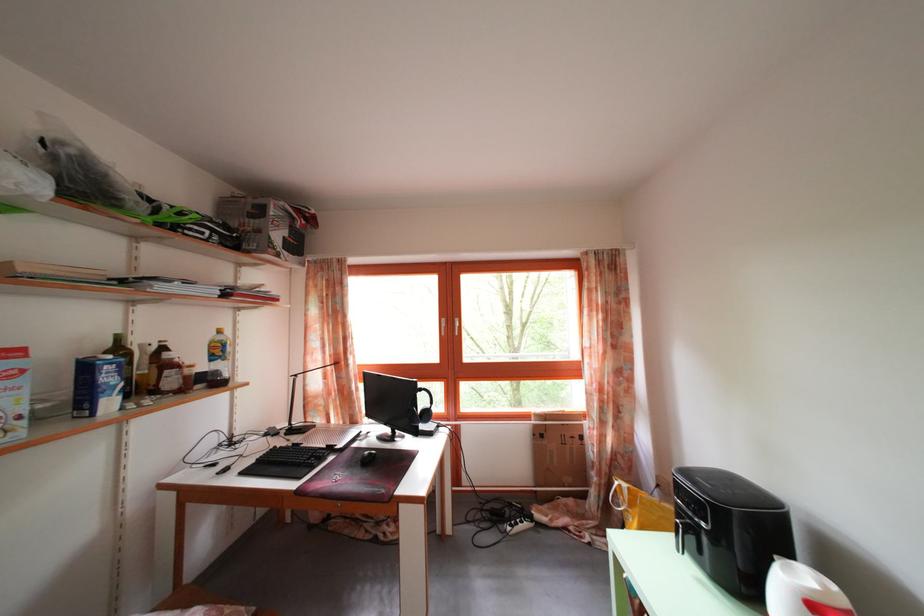
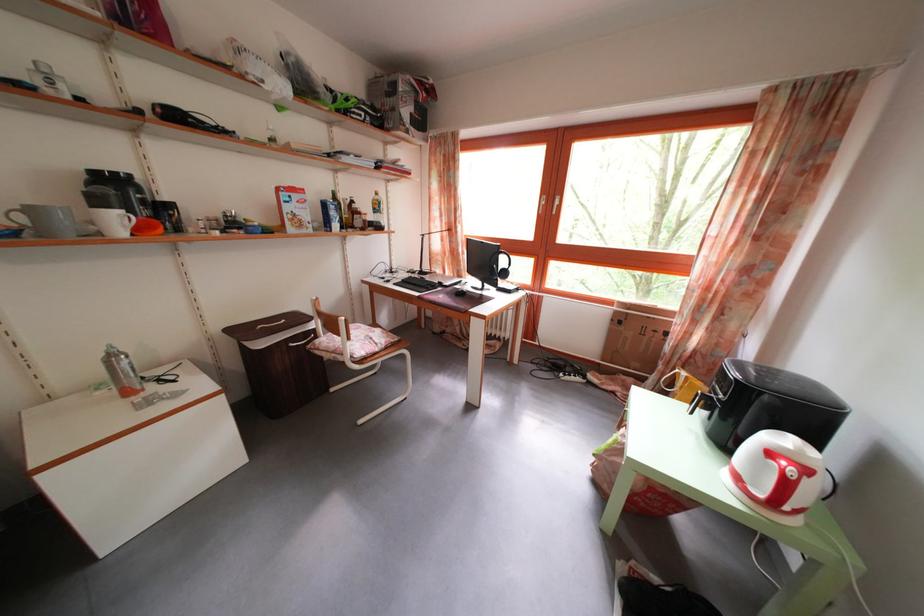
The point at (114, 376) is marked in the first image. Where is the corresponding point in the second image?

(338, 214)